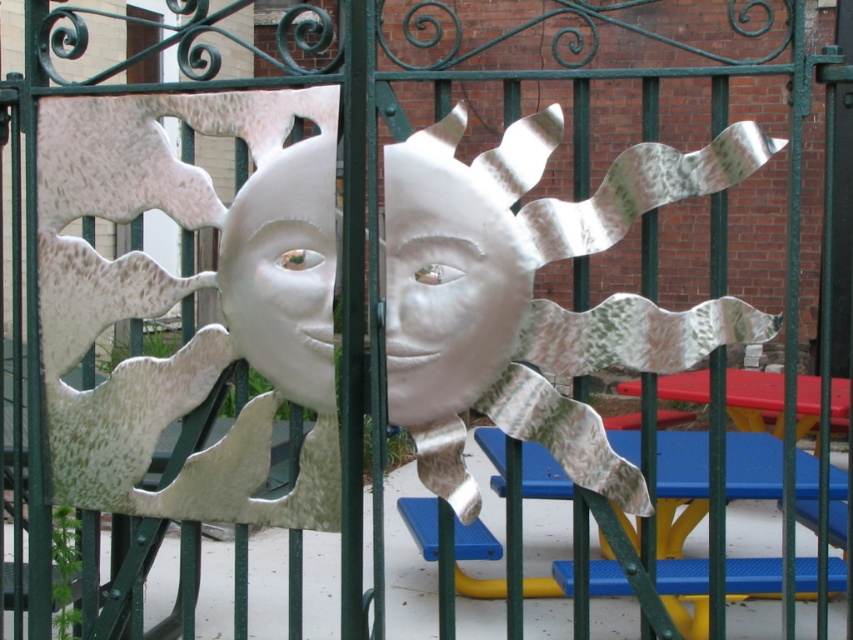
Question: Which object is positioned closest to the metallic silver sun at center?

Choices:
 (A) metallic green door at center
 (B) white metallic sun at center

Answer: (B)

Question: Which point appears farthest from the camera in this image?

Choices:
 (A) (590, 310)
 (B) (842, 307)
 (C) (202, 512)

Answer: (B)

Question: Is white metallic sun at center positioned in front of metallic green door at center?

Choices:
 (A) no
 (B) yes

Answer: (B)

Question: Is white metallic sun at center thinner than metallic silver sun at center?

Choices:
 (A) no
 (B) yes

Answer: (B)

Question: Considering the relative positions of white metallic sun at center and metallic silver sun at center in the image provided, where is white metallic sun at center located with respect to metallic silver sun at center?

Choices:
 (A) above
 (B) below

Answer: (B)

Question: Which of the following is the farthest from the observer?

Choices:
 (A) metallic green door at center
 (B) metallic silver sun at center
 (C) white metallic sun at center

Answer: (A)